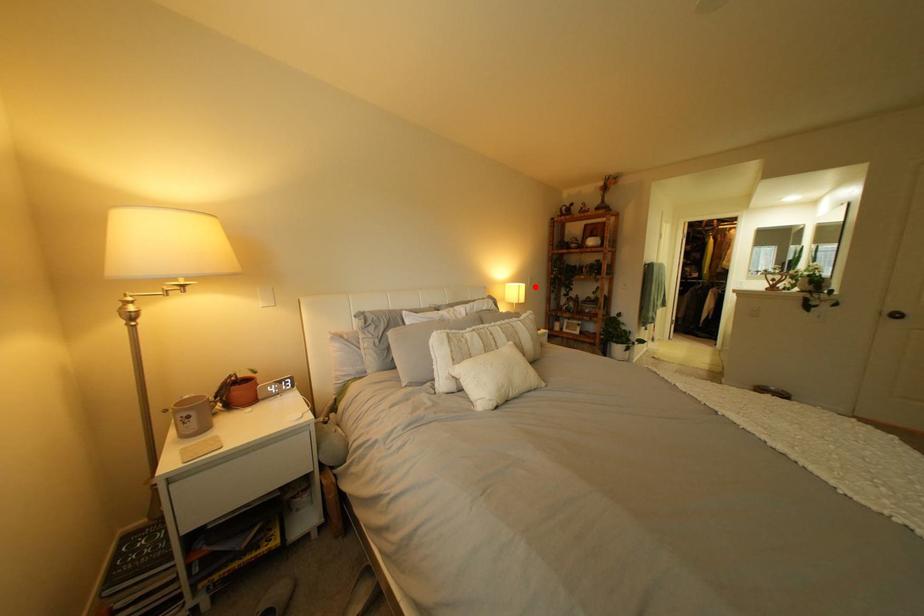
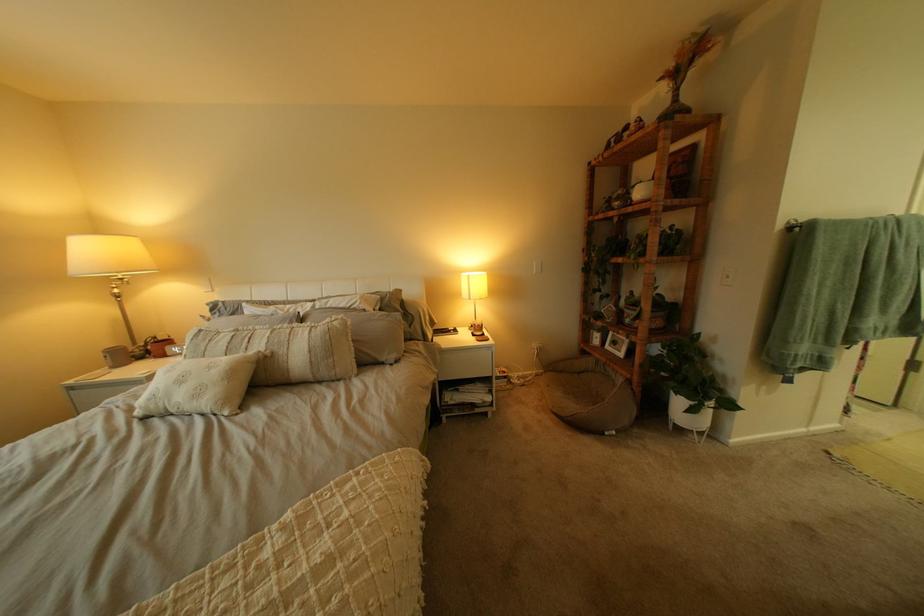
Question: I am providing you with two images of the same scene from different viewpoints. A red point is marked on the first image. At the location where the point appears in image 1, is it still visible in image 2?

Choices:
 (A) Yes
 (B) No

Answer: (A)